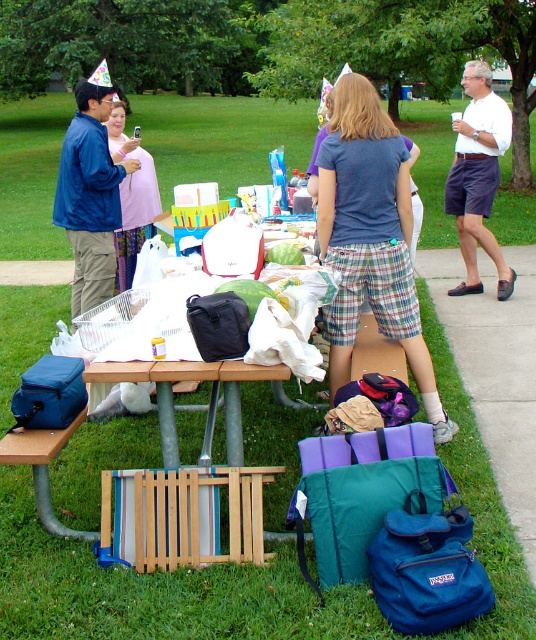
Question: Which point is closer to the camera?

Choices:
 (A) white cotton shirt at upper right
 (B) brushed metal park bench at lower left

Answer: (B)

Question: Based on their relative distances, which object is farther from the brushed metal park bench at lower left?

Choices:
 (A) blue cotton shirt at center
 (B) blue matte jacket at upper left

Answer: (B)

Question: Among these objects, which one is nearest to the camera?

Choices:
 (A) blue cotton shirt at center
 (B) brushed metal park bench at lower left
 (C) white cotton shirt at upper right

Answer: (B)

Question: Does blue matte jacket at upper left appear over pink fabric dress at left?

Choices:
 (A) yes
 (B) no

Answer: (B)

Question: Does blue cotton shirt at center appear on the right side of blue matte jacket at upper left?

Choices:
 (A) no
 (B) yes

Answer: (B)

Question: Does blue cotton shirt at center have a lesser width compared to blue matte jacket at upper left?

Choices:
 (A) no
 (B) yes

Answer: (A)